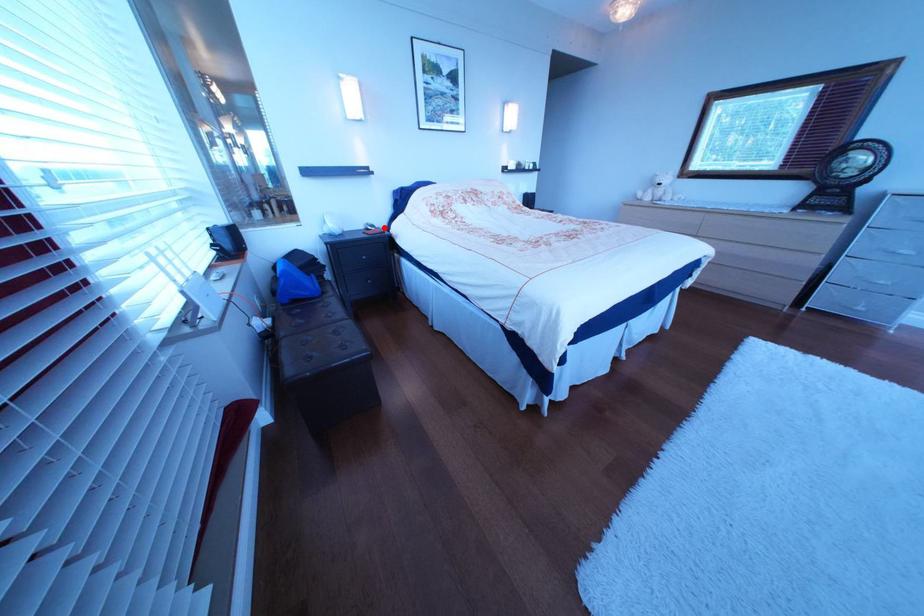
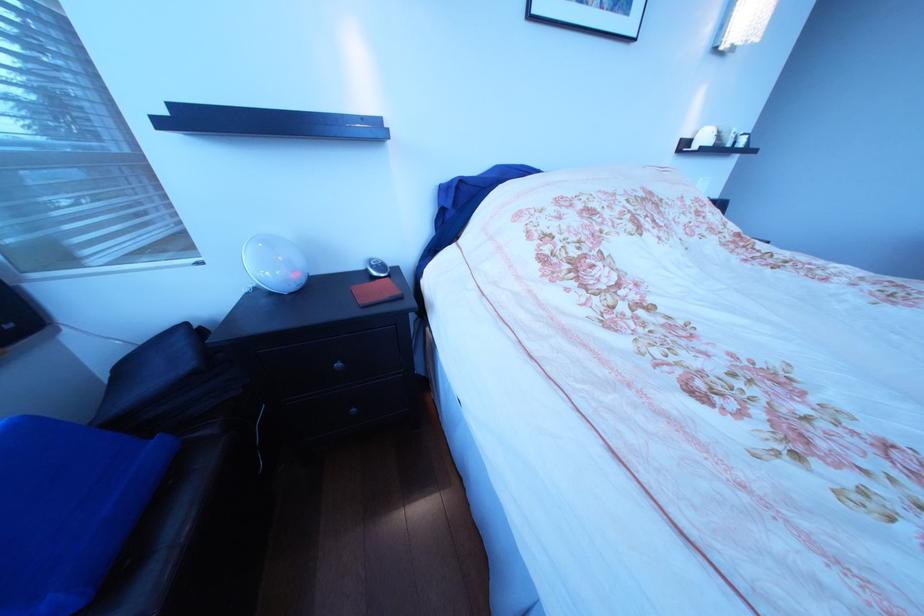
The point at the highlighted location is marked in the first image. Where is the corresponding point in the second image?

(387, 268)